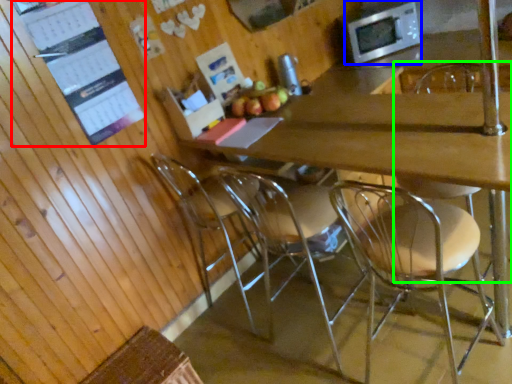
Question: Considering the real-world distances, which object is farthest from bulletin board (highlighted by a red box)? microwave oven (highlighted by a blue box) or chair (highlighted by a green box)?

Choices:
 (A) microwave oven
 (B) chair

Answer: (B)